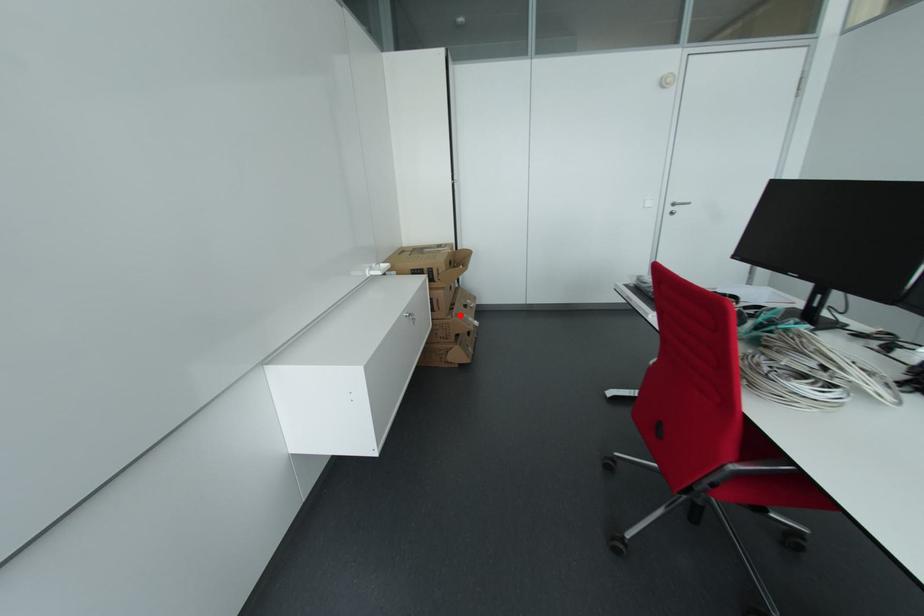
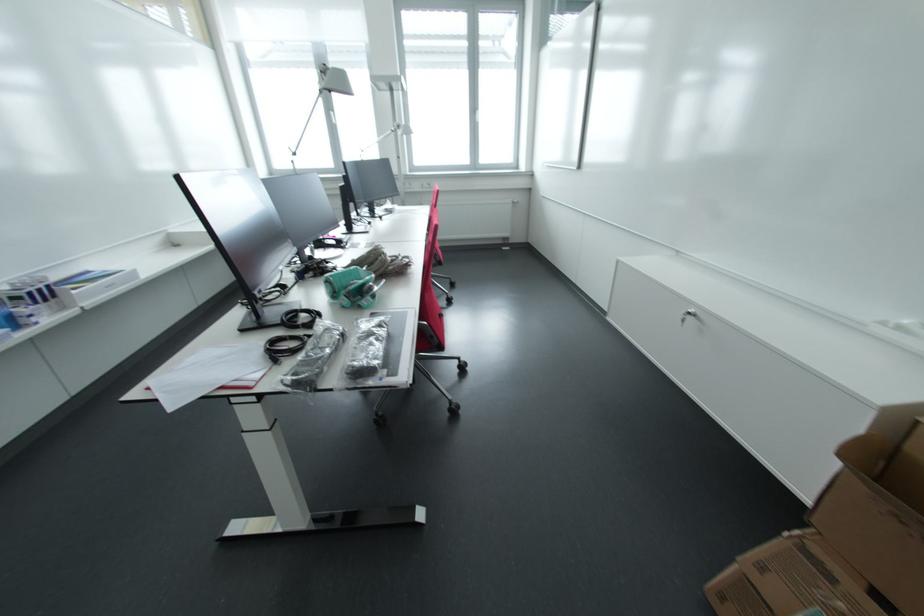
Locate, in the second image, the point that corresponds to the highlighted location in the first image.

(833, 578)